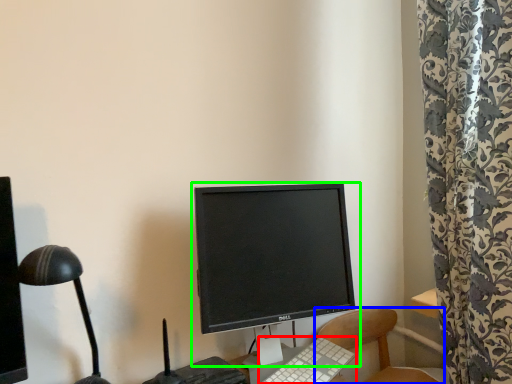
Question: Based on their relative distances, which object is nearer to computer keyboard (highlighted by a red box)? Choose from chair (highlighted by a blue box) and computer monitor (highlighted by a green box).

Choices:
 (A) chair
 (B) computer monitor

Answer: (B)